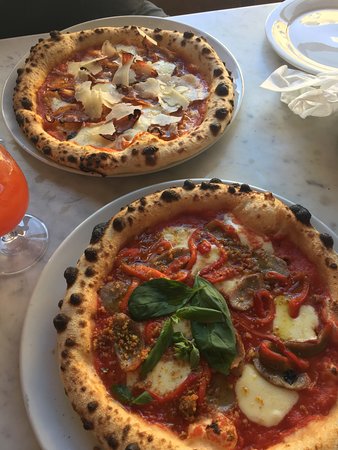
Find the location of `ceramic table`. ceramic table is located at coordinates pos(272,148).